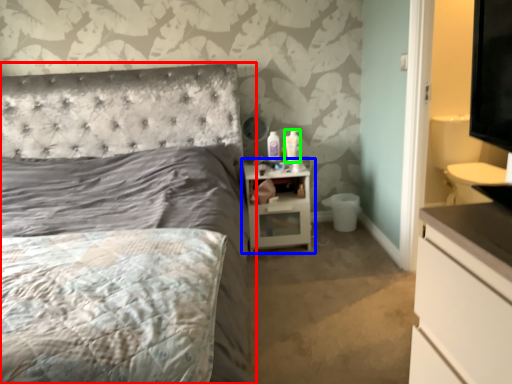
Question: Considering the real-world distances, which object is closest to bed (highlighted by a red box)? nightstand (highlighted by a blue box) or toiletry (highlighted by a green box).

Choices:
 (A) nightstand
 (B) toiletry

Answer: (A)